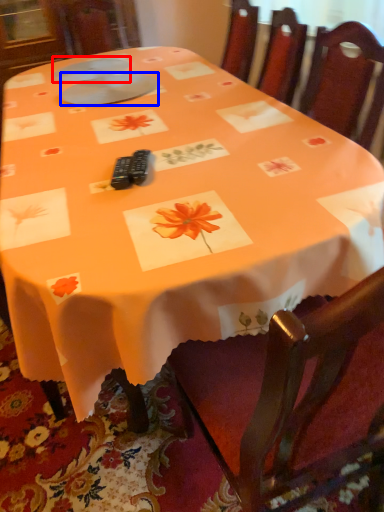
Question: Which of the following is the farthest to the observer, tableware (highlighted by a red box) or tableware (highlighted by a blue box)?

Choices:
 (A) tableware
 (B) tableware

Answer: (A)